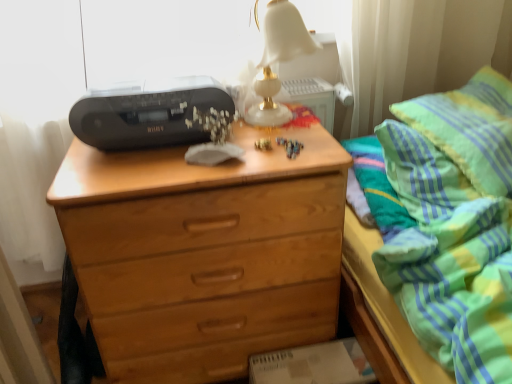
Where is `free space in front of black plastic printer at upper left`? The height and width of the screenshot is (384, 512). free space in front of black plastic printer at upper left is located at coordinates (137, 171).